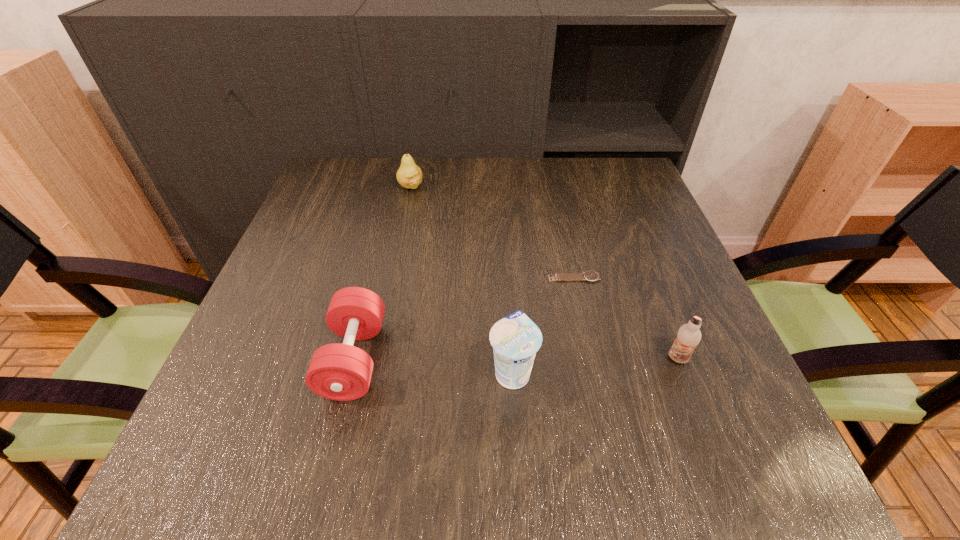
Where is `vacant space located 0.360m on the left of the shortest object`? This screenshot has height=540, width=960. vacant space located 0.360m on the left of the shortest object is located at coordinates (378, 278).

You are a GUI agent. You are given a task and a screenshot of the screen. Output one action in this format:
    pyautogui.click(x=<x>, y=<y>)
    Task: Click on the object present at the far edge
    The image size is (960, 540).
    Given the screenshot: What is the action you would take?
    pyautogui.click(x=409, y=175)

Where is `object present at the right edge`? This screenshot has height=540, width=960. object present at the right edge is located at coordinates (688, 337).

Locate an element on the screen. This screenshot has height=540, width=960. free space at the far edge of the desktop is located at coordinates (486, 195).

In the image, there is a desktop. At what (x,y) coordinates should I click in order to perform the action: click on blank space at the near edge. Please return your answer as a coordinate pair (x, y). Looking at the image, I should click on (397, 465).

I want to click on vacant area at the left edge of the desktop, so 282,260.

In the image, there is a desktop. In order to click on vacant space at the right edge in this screenshot , I will do tap(754, 414).

Where is `free space at the near right corner of the desktop`? Image resolution: width=960 pixels, height=540 pixels. free space at the near right corner of the desktop is located at coordinates (686, 447).

The width and height of the screenshot is (960, 540). Identify the location of free space between the dumbbell and the yogurt. (433, 365).

Identify the location of unoccupied position between the third object from right to left and the rightmost object. The image size is (960, 540). (595, 365).